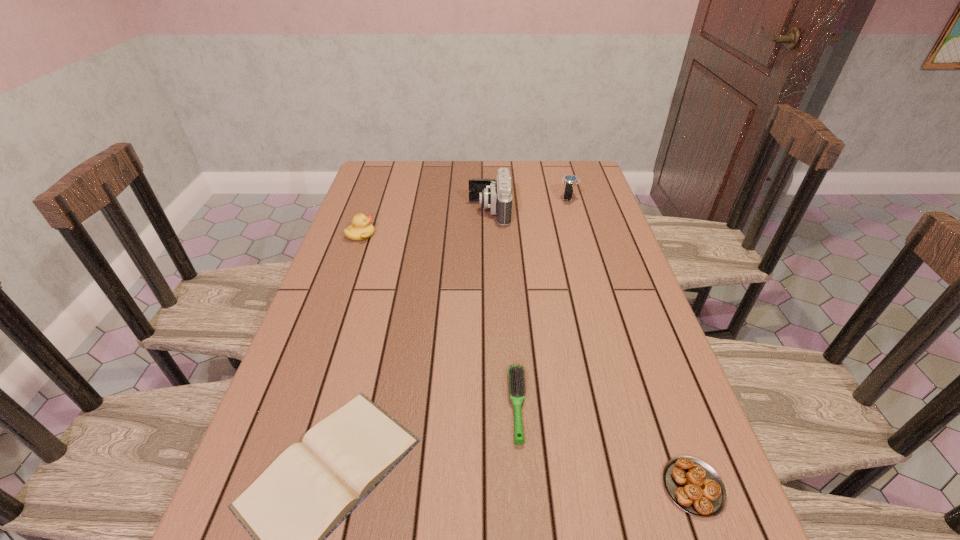
You are a GUI agent. You are given a task and a screenshot of the screen. Output one action in this format:
    pyautogui.click(x=<x>, y=<y>)
    Task: Click on the vacant position in the image that satisfies the following two spatial constraints: 1. on the front side of the pastry; 2. on the right side of the hairbrush
    The image size is (960, 540).
    Given the screenshot: What is the action you would take?
    pyautogui.click(x=524, y=487)

Locate an element on the screen. This screenshot has height=540, width=960. blank area in the image that satisfies the following two spatial constraints: 1. on the back side of the hairbrush; 2. on the front-facing side of the duckling is located at coordinates (505, 235).

Locate an element on the screen. Image resolution: width=960 pixels, height=540 pixels. vacant region that satisfies the following two spatial constraints: 1. on the front-facing side of the duckling; 2. on the left side of the hairbrush is located at coordinates [x=301, y=405].

In order to click on vacant space that satisfies the following two spatial constraints: 1. at the front of the hairbrush with an open lens cover; 2. on the left side of the camera in this screenshot , I will do `click(495, 405)`.